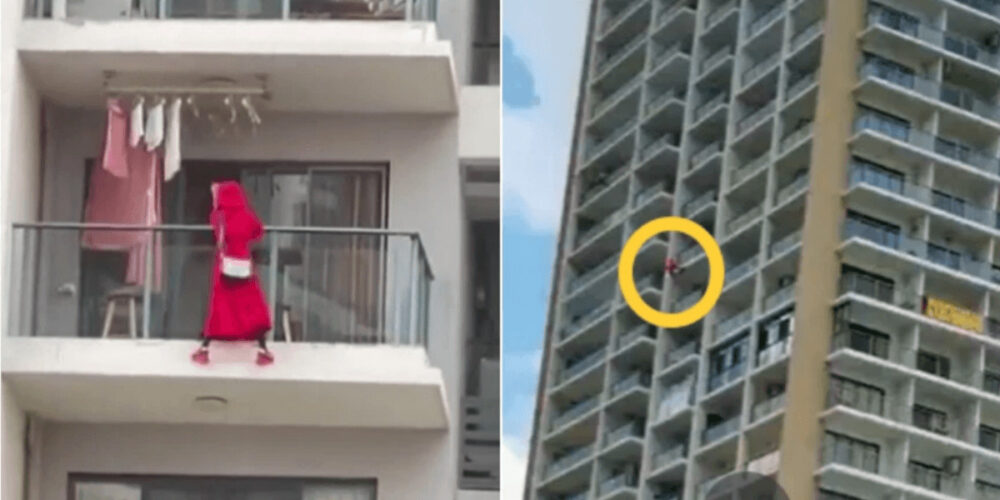
Locate an element on the screen. hangers is located at coordinates (197, 112).